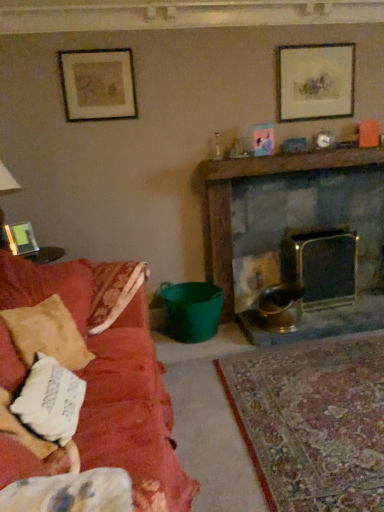
Measure the distance between matte black picture frame at upper right, which is counted as the 3th picture frame, starting from the bottom, and camera.

matte black picture frame at upper right, which is counted as the 3th picture frame, starting from the bottom, and camera are 9.68 feet apart.

What do you see at coordinates (315, 82) in the screenshot?
I see `matte black picture frame at upper right, which is the 3th picture frame from left to right` at bounding box center [315, 82].

Describe the element at coordinates (50, 401) in the screenshot. I see `white cotton pillow at left` at that location.

Identify the location of velvet red couch at left. The height and width of the screenshot is (512, 384). (113, 385).

This screenshot has height=512, width=384. I want to click on matte glass picture frame at left, the first picture frame in the bottom-to-top sequence, so click(x=21, y=239).

Is matte black picture frame at upper right, marked as the first picture frame in a top-to-bottom arrangement, smaller than velvet red couch at left?

Yes, matte black picture frame at upper right, marked as the first picture frame in a top-to-bottom arrangement, is smaller than velvet red couch at left.

From the image's perspective, which one is positioned higher, matte black picture frame at upper right, marked as the first picture frame in a top-to-bottom arrangement, or velvet red couch at left?

From the image's view, matte black picture frame at upper right, marked as the first picture frame in a top-to-bottom arrangement, is above.

Does matte black picture frame at upper right, which appears as the 1th picture frame when viewed from the right, turn towards velvet red couch at left?

No, matte black picture frame at upper right, which appears as the 1th picture frame when viewed from the right, is not turned towards velvet red couch at left.

Is velvet red couch at left a part of matte black picture frame at upper right, marked as the first picture frame in a top-to-bottom arrangement?

No, velvet red couch at left is not a part of matte black picture frame at upper right, marked as the first picture frame in a top-to-bottom arrangement.

Which object is closer to the camera, matte glass picture frame at left, the first picture frame in the bottom-to-top sequence, or dark gray stone fireplace at center right?

matte glass picture frame at left, the first picture frame in the bottom-to-top sequence, is closer to the camera.

Which is more to the left, matte glass picture frame at left, the first picture frame when ordered from left to right, or dark gray stone fireplace at center right?

matte glass picture frame at left, the first picture frame when ordered from left to right, is more to the left.

From a real-world perspective, does matte glass picture frame at left, the first picture frame in the bottom-to-top sequence, sit lower than dark gray stone fireplace at center right?

No, from a real-world perspective, matte glass picture frame at left, the first picture frame in the bottom-to-top sequence, is not beneath dark gray stone fireplace at center right.

How different are the orientations of white cotton pillow at left and dark gray stone fireplace at center right in degrees?

white cotton pillow at left and dark gray stone fireplace at center right are facing 80.4 degrees away from each other.

Which object is closer to the camera taking this photo, white cotton pillow at left or dark gray stone fireplace at center right?

white cotton pillow at left is more forward.

What are the coordinates of `pillow located below the dark gray stone fireplace at center right (from the image's perspective)` in the screenshot? It's located at (50, 401).

Which object is thinner, white cotton pillow at left or dark gray stone fireplace at center right?

white cotton pillow at left.

Is velvet red couch at left oriented towards matte glass picture frame at left, the first picture frame in the bottom-to-top sequence?

No.

Is velvet red couch at left to the left of matte glass picture frame at left, the first picture frame when ordered from left to right, from the viewer's perspective?

In fact, velvet red couch at left is to the right of matte glass picture frame at left, the first picture frame when ordered from left to right.

From the image's perspective, between velvet red couch at left and matte glass picture frame at left, the first picture frame in the bottom-to-top sequence, which one is located above?

matte glass picture frame at left, the first picture frame in the bottom-to-top sequence, is shown above in the image.

Considering the relative sizes of velvet red couch at left and matte glass picture frame at left, the first picture frame when ordered from left to right, in the image provided, is velvet red couch at left wider than matte glass picture frame at left, the first picture frame when ordered from left to right,?

Yes, velvet red couch at left is wider than matte glass picture frame at left, the first picture frame when ordered from left to right.

Do you think matte black picture frame at upper right, which is the 3th picture frame from left to right, is within dark gray stone fireplace at center right, or outside of it?

matte black picture frame at upper right, which is the 3th picture frame from left to right, exists outside the volume of dark gray stone fireplace at center right.

Is matte black picture frame at upper right, which is counted as the 3th picture frame, starting from the bottom, in front of or behind dark gray stone fireplace at center right in the image?

matte black picture frame at upper right, which is counted as the 3th picture frame, starting from the bottom, is positioned closer to the viewer than dark gray stone fireplace at center right.

Is matte black picture frame at upper right, which appears as the 1th picture frame when viewed from the right, bigger than dark gray stone fireplace at center right?

No.

From a real-world perspective, is matte black picture frame at upper right, which is the 3th picture frame from left to right, physically above dark gray stone fireplace at center right?

Yes, from a real-world perspective, matte black picture frame at upper right, which is the 3th picture frame from left to right, is over dark gray stone fireplace at center right

From the image's perspective, which picture frame is the 1st one below the matte black picture frame at upper right, marked as the first picture frame in a top-to-bottom arrangement? Please provide its 2D coordinates.

[(98, 84)]

Between matte black picture frame at upper right, which is the 3th picture frame from left to right, and matte gold picture frame at upper left, which is the 2th picture frame from bottom to top, which one has smaller size?

Smaller between the two is matte gold picture frame at upper left, which is the 2th picture frame from bottom to top.

From a real-world perspective, is matte black picture frame at upper right, marked as the first picture frame in a top-to-bottom arrangement, below matte gold picture frame at upper left, acting as the 2th picture frame starting from the left?

Yes.

Can we say matte black picture frame at upper right, which is counted as the 3th picture frame, starting from the bottom, lies outside matte gold picture frame at upper left, the 2th picture frame when ordered from top to bottom?

That's correct, matte black picture frame at upper right, which is counted as the 3th picture frame, starting from the bottom, is outside of matte gold picture frame at upper left, the 2th picture frame when ordered from top to bottom.

Is white cotton pillow at left wider or thinner than matte gold picture frame at upper left, the 2th picture frame when ordered from top to bottom?

white cotton pillow at left is wider than matte gold picture frame at upper left, the 2th picture frame when ordered from top to bottom.

Considering the points (47, 422) and (126, 110), which point is in front, point (47, 422) or point (126, 110)?

The point (47, 422) is closer to the camera.

Is white cotton pillow at left completely or partially outside of matte gold picture frame at upper left, the 2th picture frame when ordered from top to bottom?

Yes, white cotton pillow at left is outside of matte gold picture frame at upper left, the 2th picture frame when ordered from top to bottom.

Considering the relative positions of white cotton pillow at left and matte gold picture frame at upper left, the 2th picture frame when ordered from top to bottom, in the image provided, is white cotton pillow at left to the left or to the right of matte gold picture frame at upper left, the 2th picture frame when ordered from top to bottom,?

white cotton pillow at left is positioned on matte gold picture frame at upper left, the 2th picture frame when ordered from top to bottom,'s right side.

In order to click on picture frame that is the 3rd one when counting backward from the velvet red couch at left in this screenshot , I will do `click(315, 82)`.

This screenshot has width=384, height=512. In order to click on the 2nd picture frame to the left of the dark gray stone fireplace at center right, starting your count from the anchor in this screenshot , I will do `click(21, 239)`.

Looking at the image, which one is located closer to dark gray stone fireplace at center right, wooden mantel at upper center or velvet red couch at left?

wooden mantel at upper center is positioned closer to the anchor dark gray stone fireplace at center right.

Which object lies further to the anchor point wooden mantel at upper center, matte black picture frame at upper right, marked as the first picture frame in a top-to-bottom arrangement, or dark gray stone fireplace at center right?

Based on the image, matte black picture frame at upper right, marked as the first picture frame in a top-to-bottom arrangement, appears to be further to wooden mantel at upper center.

From the image, which object appears to be farther from white cotton pillow at left, dark gray stone fireplace at center right or matte glass picture frame at left, arranged as the third picture frame when viewed from the top?

The object further to white cotton pillow at left is dark gray stone fireplace at center right.

Looking at the image, which one is located closer to matte black picture frame at upper right, marked as the first picture frame in a top-to-bottom arrangement, velvet red couch at left or wooden mantel at upper center?

Among the two, wooden mantel at upper center is located nearer to matte black picture frame at upper right, marked as the first picture frame in a top-to-bottom arrangement.

Which object lies further to the anchor point velvet red couch at left, matte black picture frame at upper right, which is the 3th picture frame from left to right, or white cotton pillow at left?

matte black picture frame at upper right, which is the 3th picture frame from left to right, lies further to velvet red couch at left than the other object.

Considering their positions, is velvet red couch at left positioned closer to matte gold picture frame at upper left, arranged as the 2th picture frame when viewed from the right, than white cotton pillow at left?

velvet red couch at left lies closer to matte gold picture frame at upper left, arranged as the 2th picture frame when viewed from the right, than the other object.

From the image, which object appears to be nearer to white cotton pillow at left, matte black picture frame at upper right, which is the 3th picture frame from left to right, or wooden mantel at upper center?

wooden mantel at upper center is positioned closer to the anchor white cotton pillow at left.

From the image, which object appears to be farther from dark gray stone fireplace at center right, wooden mantel at upper center or matte black picture frame at upper right, which is counted as the 3th picture frame, starting from the bottom?

The object further to dark gray stone fireplace at center right is matte black picture frame at upper right, which is counted as the 3th picture frame, starting from the bottom.

Where is `picture frame between velvet red couch at left and matte glass picture frame at left, the first picture frame in the bottom-to-top sequence, along the z-axis`? The height and width of the screenshot is (512, 384). picture frame between velvet red couch at left and matte glass picture frame at left, the first picture frame in the bottom-to-top sequence, along the z-axis is located at coordinates (98, 84).

You are a GUI agent. You are given a task and a screenshot of the screen. Output one action in this format:
    pyautogui.click(x=<x>, y=<y>)
    Task: Click on the pillow located between velvet red couch at left and matte glass picture frame at left, the first picture frame when ordered from left to right, in the depth direction
    This screenshot has width=384, height=512.
    Given the screenshot: What is the action you would take?
    pyautogui.click(x=50, y=401)

Find the location of a particular element. This screenshot has width=384, height=512. pillow situated between matte glass picture frame at left, arranged as the third picture frame when viewed from the top, and wooden mantel at upper center from left to right is located at coordinates (50, 401).

Locate an element on the screen. mantle between white cotton pillow at left and dark gray stone fireplace at center right along the z-axis is located at coordinates (287, 163).